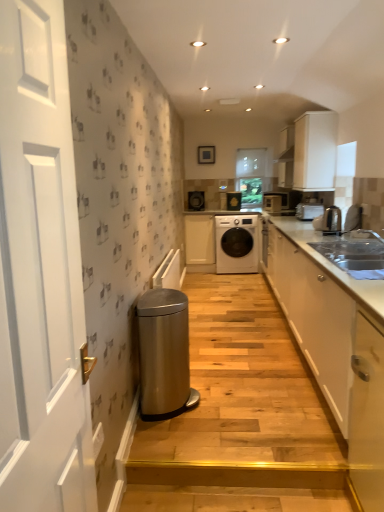
Question: Considering the relative sizes of black glossy washing machine at center, the 5th appliance when ordered from front to back, and silver metallic sink at right in the image provided, is black glossy washing machine at center, the 5th appliance when ordered from front to back, taller than silver metallic sink at right?

Choices:
 (A) yes
 (B) no

Answer: (A)

Question: Is black glossy washing machine at center, which appears as the fourth appliance when viewed from the right, far away from silver metallic sink at right?

Choices:
 (A) yes
 (B) no

Answer: (A)

Question: From a real-world perspective, is black glossy washing machine at center, which appears as the fourth appliance when viewed from the right, beneath silver metallic sink at right?

Choices:
 (A) no
 (B) yes

Answer: (A)

Question: From a real-world perspective, is black glossy washing machine at center, the 2th appliance from the left, over silver metallic sink at right?

Choices:
 (A) yes
 (B) no

Answer: (A)

Question: Is black glossy washing machine at center, which is counted as the first appliance, starting from the back, to the left of silver metallic sink at right from the viewer's perspective?

Choices:
 (A) yes
 (B) no

Answer: (A)

Question: From the image's perspective, is white glossy cabinet at right, the 2th cabinetry viewed from the front, located above or below silver metallic sink at right?

Choices:
 (A) above
 (B) below

Answer: (B)

Question: Would you say white glossy cabinet at right, which ranks as the second cabinetry in right-to-left order, is inside or outside silver metallic sink at right?

Choices:
 (A) outside
 (B) inside

Answer: (A)

Question: Is white glossy cabinet at right, which ranks as the second cabinetry in right-to-left order, in front of or behind silver metallic sink at right in the image?

Choices:
 (A) behind
 (B) front

Answer: (B)

Question: From a real-world perspective, is white glossy cabinet at right, which ranks as the second cabinetry in right-to-left order, physically located above or below silver metallic sink at right?

Choices:
 (A) below
 (B) above

Answer: (A)

Question: From a real-world perspective, is transparent glass window at center positioned above or below white glossy cabinet at right, the 3th cabinetry in the back-to-front sequence?

Choices:
 (A) below
 (B) above

Answer: (B)

Question: Is transparent glass window at center to the left or to the right of white glossy cabinet at right, the 2th cabinetry viewed from the front, in the image?

Choices:
 (A) right
 (B) left

Answer: (B)

Question: Does point (251, 176) appear closer or farther from the camera than point (349, 393)?

Choices:
 (A) closer
 (B) farther

Answer: (B)

Question: Which is correct: transparent glass window at center is inside white glossy cabinet at right, which ranks as the second cabinetry in right-to-left order, or outside of it?

Choices:
 (A) outside
 (B) inside

Answer: (A)

Question: Considering the positions of wooden step at lower center, arranged as the 1th stairwell when viewed from the front, and white glossy cabinet at right, which ranks as the second cabinetry in right-to-left order, in the image, is wooden step at lower center, arranged as the 1th stairwell when viewed from the front, bigger or smaller than white glossy cabinet at right, which ranks as the second cabinetry in right-to-left order,?

Choices:
 (A) big
 (B) small

Answer: (B)

Question: Considering the positions of wooden step at lower center, arranged as the 1th stairwell when viewed from the front, and white glossy cabinet at right, which ranks as the second cabinetry in right-to-left order, in the image, is wooden step at lower center, arranged as the 1th stairwell when viewed from the front, wider or thinner than white glossy cabinet at right, which ranks as the second cabinetry in right-to-left order,?

Choices:
 (A) thin
 (B) wide

Answer: (A)